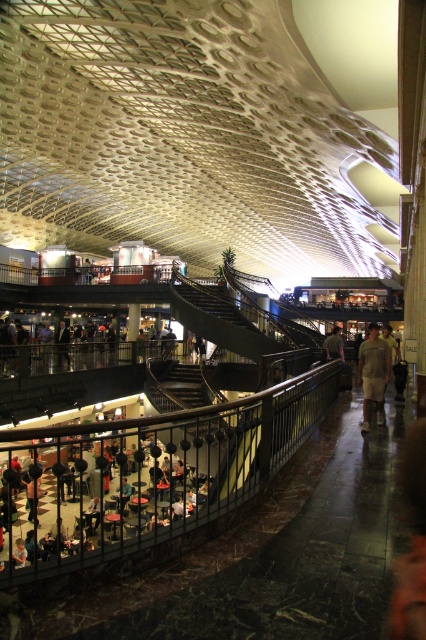
You are standing at the base of the curved staircase with a black railing and want to walk towards the point labeled as point (49, 529). Will you pass by point (181, 378) before reaching your destination?

Yes, because point (49, 529) is in front of point (181, 378), so you will pass by point (181, 378) before reaching point (49, 529).